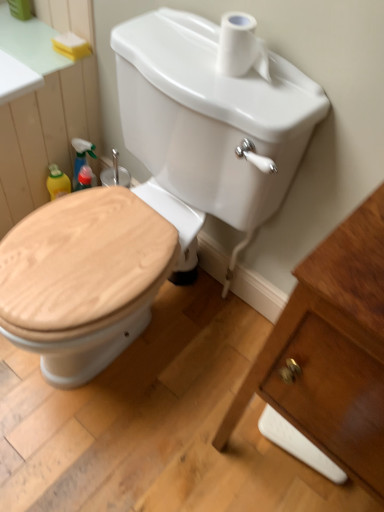
The image size is (384, 512). Identify the location of yellow sponge at upper left. (71, 45).

What do you see at coordinates (158, 191) in the screenshot? Image resolution: width=384 pixels, height=512 pixels. I see `wooden toilet seat at center` at bounding box center [158, 191].

The width and height of the screenshot is (384, 512). What are the coordinates of `white glossy porcelain at right` in the screenshot? It's located at (332, 350).

From a real-world perspective, who is located lower, wooden toilet seat at center or white matte toilet paper at upper center?

In real-world perspective, wooden toilet seat at center is lower.

Does point (129, 282) come in front of point (220, 56)?

No, (129, 282) is further to viewer.

From the image's perspective, is wooden toilet seat at center beneath white matte toilet paper at upper center?

Correct, wooden toilet seat at center appears lower than white matte toilet paper at upper center in the image.

Between yellow sponge at upper left and white matte toilet paper at upper center, which one has larger width?

yellow sponge at upper left.

Is yellow sponge at upper left smaller than white matte toilet paper at upper center?

Yes, yellow sponge at upper left is smaller than white matte toilet paper at upper center.

Is yellow sponge at upper left not near white matte toilet paper at upper center?

No, there isn't a large distance between yellow sponge at upper left and white matte toilet paper at upper center.

Could you tell me if yellow sponge at upper left is facing white matte toilet paper at upper center?

No, yellow sponge at upper left is not facing towards white matte toilet paper at upper center.

Locate an element on the screen. The height and width of the screenshot is (512, 384). toilet paper above the wooden toilet seat at center (from the image's perspective) is located at coordinates (241, 47).

Does point (249, 46) lie behind point (87, 252)?

No.

From the image's perspective, is white matte toilet paper at upper center on wooden toilet seat at center?

Yes, from the image's perspective, white matte toilet paper at upper center is over wooden toilet seat at center.

Looking at this image, how different are the orientations of white matte toilet paper at upper center and wooden toilet seat at center in degrees?

They differ by 2.1 degrees in their facing directions.

Based on their sizes in the image, would you say yellow sponge at upper left is bigger or smaller than wooden toilet seat at center?

Clearly, yellow sponge at upper left is smaller in size than wooden toilet seat at center.

How far apart are yellow sponge at upper left and wooden toilet seat at center?

yellow sponge at upper left and wooden toilet seat at center are 64.12 centimeters apart.

Is yellow sponge at upper left at the right side of wooden toilet seat at center?

No.

Consider the image. Can you tell me how much white matte toilet paper at upper center and yellow sponge at upper left differ in facing direction?

white matte toilet paper at upper center and yellow sponge at upper left are facing 3.79 degrees away from each other.

Who is taller, white matte toilet paper at upper center or yellow sponge at upper left?

Standing taller between the two is white matte toilet paper at upper center.

Consider the image. Does white matte toilet paper at upper center have a larger size compared to yellow sponge at upper left?

Yes, white matte toilet paper at upper center is bigger than yellow sponge at upper left.

Identify the location of soap that is on the left side of white matte toilet paper at upper center. The height and width of the screenshot is (512, 384). (71, 45).

Is there a large distance between white matte toilet paper at upper center and white glossy porcelain at right?

Actually, white matte toilet paper at upper center and white glossy porcelain at right are a little close together.

I want to click on porcelain in front of the white matte toilet paper at upper center, so click(332, 350).

Is white matte toilet paper at upper center taller than white glossy porcelain at right?

No, white matte toilet paper at upper center is not taller than white glossy porcelain at right.

Considering the relative positions of wooden toilet seat at center and yellow sponge at upper left in the image provided, is wooden toilet seat at center to the right of yellow sponge at upper left from the viewer's perspective?

Indeed, wooden toilet seat at center is positioned on the right side of yellow sponge at upper left.

Which point is more forward, (146, 239) or (62, 41)?

Positioned in front is point (146, 239).

Which of these two, wooden toilet seat at center or yellow sponge at upper left, is smaller?

With smaller size is yellow sponge at upper left.

Consider the image. Considering the relative sizes of wooden toilet seat at center and yellow sponge at upper left in the image provided, is wooden toilet seat at center shorter than yellow sponge at upper left?

In fact, wooden toilet seat at center may be taller than yellow sponge at upper left.

Locate an element on the screen. toilet paper above the wooden toilet seat at center (from a real-world perspective) is located at coordinates (241, 47).

This screenshot has height=512, width=384. I want to click on toilet paper below the yellow sponge at upper left (from the image's perspective), so click(x=241, y=47).

Estimate the real-world distances between objects in this image. Which object is closer to yellow sponge at upper left, white matte toilet paper at upper center or white glossy porcelain at right?

white matte toilet paper at upper center.

From the image, which object appears to be nearer to wooden toilet seat at center, white matte toilet paper at upper center or yellow sponge at upper left?

white matte toilet paper at upper center.

Based on their spatial positions, is yellow sponge at upper left or white matte toilet paper at upper center further from white glossy porcelain at right?

The object further to white glossy porcelain at right is yellow sponge at upper left.

Looking at the image, which one is located closer to wooden toilet seat at center, yellow sponge at upper left or white glossy porcelain at right?

white glossy porcelain at right is positioned closer to the anchor wooden toilet seat at center.

Estimate the real-world distances between objects in this image. Which object is further from yellow sponge at upper left, wooden toilet seat at center or white glossy porcelain at right?

Based on the image, white glossy porcelain at right appears to be further to yellow sponge at upper left.

When comparing their distances from wooden toilet seat at center, does white glossy porcelain at right or white matte toilet paper at upper center seem closer?

Based on the image, white matte toilet paper at upper center appears to be nearer to wooden toilet seat at center.

Considering their positions, is wooden toilet seat at center positioned closer to yellow sponge at upper left than white matte toilet paper at upper center?

white matte toilet paper at upper center lies closer to yellow sponge at upper left than the other object.

Estimate the real-world distances between objects in this image. Which object is closer to white matte toilet paper at upper center, yellow sponge at upper left or white glossy porcelain at right?

Among the two, white glossy porcelain at right is located nearer to white matte toilet paper at upper center.

Where is `toilet between white matte toilet paper at upper center and white glossy porcelain at right in the vertical direction`? This screenshot has height=512, width=384. toilet between white matte toilet paper at upper center and white glossy porcelain at right in the vertical direction is located at coordinates (158, 191).

The width and height of the screenshot is (384, 512). Find the location of `toilet paper between yellow sponge at upper left and white glossy porcelain at right in the vertical direction`. toilet paper between yellow sponge at upper left and white glossy porcelain at right in the vertical direction is located at coordinates (241, 47).

Find the location of a particular element. toilet between white glossy porcelain at right and yellow sponge at upper left from front to back is located at coordinates (158, 191).

You are a GUI agent. You are given a task and a screenshot of the screen. Output one action in this format:
    pyautogui.click(x=<x>, y=<y>)
    Task: Click on the toilet paper between wooden toilet seat at center and yellow sponge at upper left along the z-axis
    The image size is (384, 512).
    Given the screenshot: What is the action you would take?
    pyautogui.click(x=241, y=47)